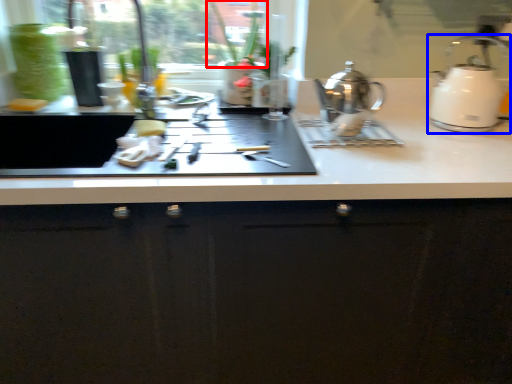
Question: Among these objects, which one is nearest to the camera, plant (highlighted by a red box) or kettle (highlighted by a blue box)?

Choices:
 (A) plant
 (B) kettle

Answer: (B)